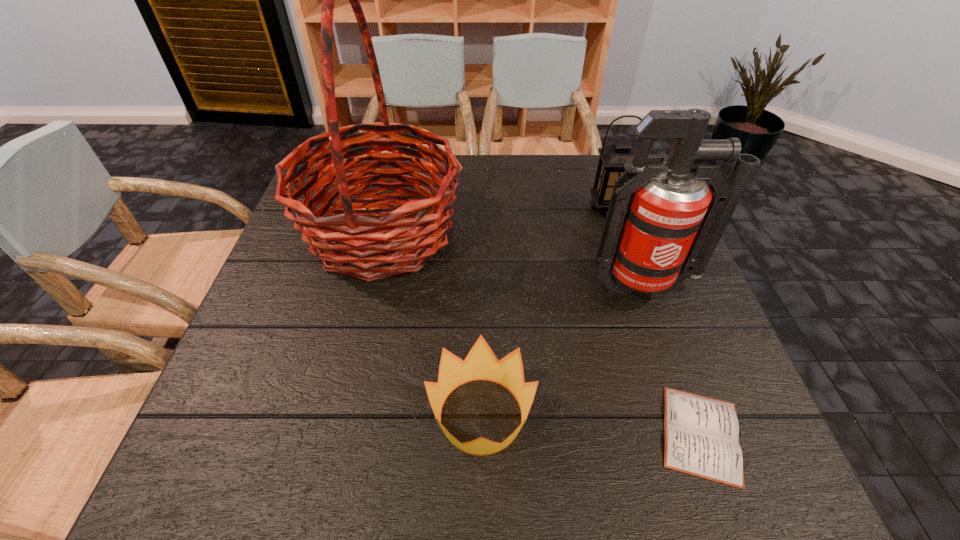
Where is `the tallest object`? the tallest object is located at coordinates [x=354, y=243].

This screenshot has height=540, width=960. Find the location of `the second tallest object`. the second tallest object is located at coordinates (663, 225).

I want to click on lantern, so click(613, 157).

Locate an element on the screen. The width and height of the screenshot is (960, 540). the fourth tallest object is located at coordinates (480, 364).

Where is `the shortest object`? The image size is (960, 540). the shortest object is located at coordinates [x=701, y=434].

You are a GUI agent. You are given a task and a screenshot of the screen. Output one action in this format:
    pyautogui.click(x=<x>, y=<y>)
    Task: Click on the blank area located 0.350m on the handle side of the tallest object
    Image resolution: width=960 pixels, height=540 pixels.
    Given the screenshot: What is the action you would take?
    point(602,232)

Identify the location of vacant space located 0.300m on the front label side of the fourth shortest object. (702, 448).

This screenshot has width=960, height=540. Find the location of `free space located on the front of the lantern`. free space located on the front of the lantern is located at coordinates (617, 241).

I want to click on vacant space located 0.160m on the back of the fourth tallest object, so click(481, 307).

The height and width of the screenshot is (540, 960). Identify the location of vacant area situated 0.220m on the left of the shortest object. (526, 434).